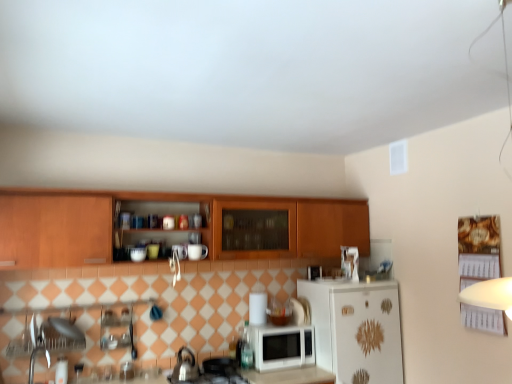
Question: Is brushed metal tea pot at lower center aimed at wooden cabinets at center?

Choices:
 (A) no
 (B) yes

Answer: (A)

Question: Is brushed metal tea pot at lower center positioned with its back to wooden cabinets at center?

Choices:
 (A) yes
 (B) no

Answer: (B)

Question: Would you say brushed metal tea pot at lower center contains wooden cabinets at center?

Choices:
 (A) yes
 (B) no

Answer: (B)

Question: From the image's perspective, would you say brushed metal tea pot at lower center is shown under wooden cabinets at center?

Choices:
 (A) yes
 (B) no

Answer: (A)

Question: Does brushed metal tea pot at lower center have a smaller size compared to wooden cabinets at center?

Choices:
 (A) yes
 (B) no

Answer: (A)

Question: Considering the relative positions of brushed metal tea pot at lower center and wooden cabinets at center in the image provided, is brushed metal tea pot at lower center to the left of wooden cabinets at center from the viewer's perspective?

Choices:
 (A) no
 (B) yes

Answer: (B)

Question: Is wooden cabinets at center wider than white matte refrigerator at lower right?

Choices:
 (A) no
 (B) yes

Answer: (A)

Question: Can you confirm if wooden cabinets at center is taller than white matte refrigerator at lower right?

Choices:
 (A) yes
 (B) no

Answer: (B)

Question: Are wooden cabinets at center and white matte refrigerator at lower right making contact?

Choices:
 (A) yes
 (B) no

Answer: (B)

Question: Can you confirm if wooden cabinets at center is thinner than white matte refrigerator at lower right?

Choices:
 (A) yes
 (B) no

Answer: (A)

Question: Considering the relative sizes of wooden cabinets at center and white matte refrigerator at lower right in the image provided, is wooden cabinets at center shorter than white matte refrigerator at lower right?

Choices:
 (A) yes
 (B) no

Answer: (A)

Question: From the image's perspective, is wooden cabinets at center above white matte refrigerator at lower right?

Choices:
 (A) yes
 (B) no

Answer: (A)

Question: Is brushed metal tea pot at lower center behind white matte refrigerator at lower right?

Choices:
 (A) no
 (B) yes

Answer: (A)